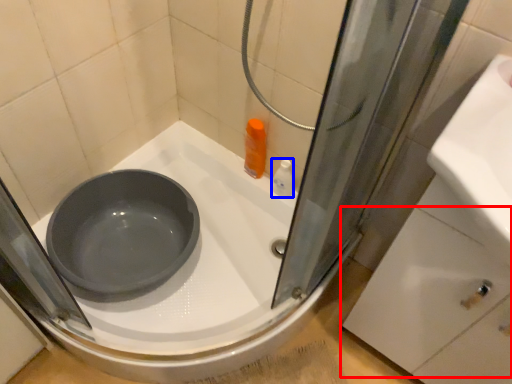
Question: Which object is closer to the camera taking this photo, drawer (highlighted by a red box) or toiletry (highlighted by a blue box)?

Choices:
 (A) drawer
 (B) toiletry

Answer: (A)